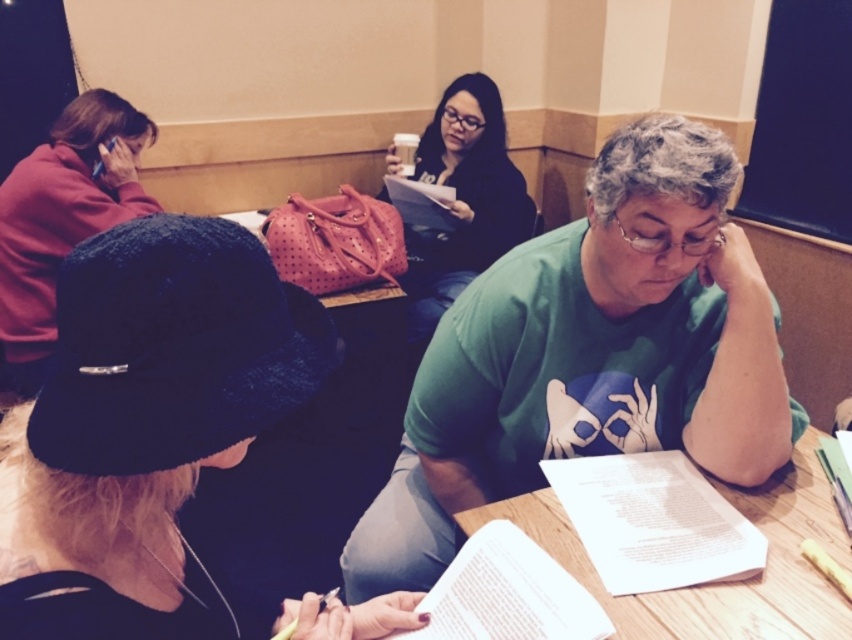
Is point (582, 310) less distant than point (491, 132)?

Yes, it is in front of point (491, 132).

Does point (383, 524) lie behind point (378, 198)?

No, (383, 524) is closer to viewer.

Between point (597, 280) and point (492, 196), which one is positioned behind?

The point (492, 196) is behind.

This screenshot has height=640, width=852. Identify the location of green matte shirt at center. (590, 355).

Can you confirm if black felt hat at upper left is wider than matte red hoodie at upper left?

In fact, black felt hat at upper left might be narrower than matte red hoodie at upper left.

Is black felt hat at upper left positioned at the back of matte red hoodie at upper left?

No.

Between point (42, 396) and point (113, 161), which one is positioned behind?

Positioned behind is point (113, 161).

Where is `black felt hat at upper left`? The image size is (852, 640). black felt hat at upper left is located at coordinates (142, 420).

Between black felt hat at upper left and matte black shirt at center, which one has less height?

black felt hat at upper left

In order to click on black felt hat at upper left in this screenshot , I will do `click(142, 420)`.